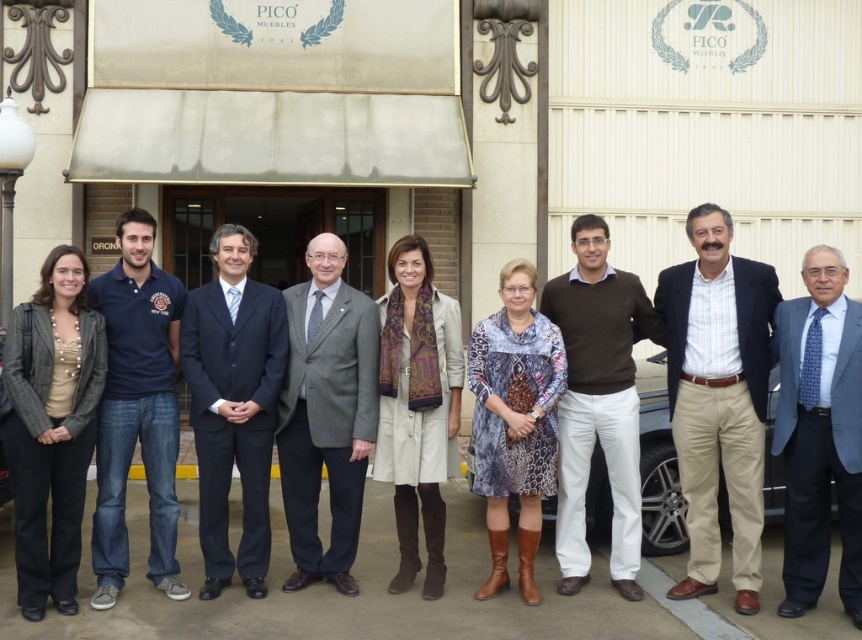
You are standing in front of the PICO MUEBLES 1943 building and notice a dark gray textured jacket at left. Based on its position coordinates, is the jacket closer to the top or bottom of the image?

The dark gray textured jacket at left is located at point 0.060 on the vertical axis, which places it closer to the bottom of the image.

Based on the scene description, where is the brown cotton pants at center located in terms of coordinates?

The brown cotton pants at center is located at coordinates point (x=717, y=397).

What is located at the coordinates point (717, 397)?

The brown cotton pants at center are located at point (717, 397).